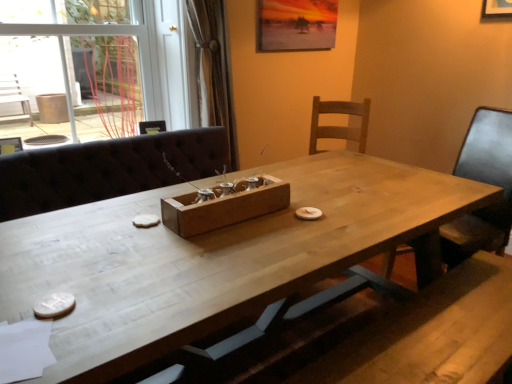
You are a GUI agent. You are given a task and a screenshot of the screen. Output one action in this format:
    pyautogui.click(x=<x>, y=<y>)
    Task: Click on the empty space that is ontop of white wood table at center
    
    Given the screenshot: What is the action you would take?
    pyautogui.click(x=263, y=216)